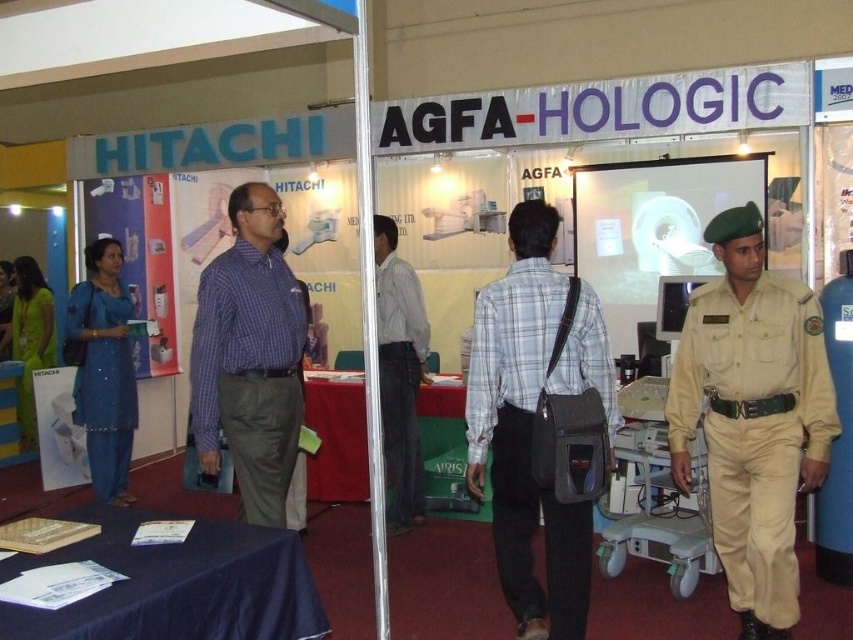
Measure the distance from blue sequined salwar kameez at left to dark gray fabric shirt at center.

blue sequined salwar kameez at left and dark gray fabric shirt at center are 6.26 feet apart.

Does blue sequined salwar kameez at left appear on the left side of dark gray fabric shirt at center?

Yes, blue sequined salwar kameez at left is to the left of dark gray fabric shirt at center.

Is point (74, 384) less distant than point (401, 435)?

No, (74, 384) is further to viewer.

What are the coordinates of `blue sequined salwar kameez at left` in the screenshot? It's located at (103, 381).

Is tan uniform at right to the left of gray fabric bag at center from the viewer's perspective?

Incorrect, tan uniform at right is not on the left side of gray fabric bag at center.

Which is above, tan uniform at right or gray fabric bag at center?

gray fabric bag at center

The image size is (853, 640). I want to click on tan uniform at right, so click(x=753, y=428).

Find the location of a particular element. The image size is (853, 640). dark gray fabric shirt at center is located at coordinates (399, 381).

Find the location of `dark gray fabric shirt at center`. dark gray fabric shirt at center is located at coordinates (399, 381).